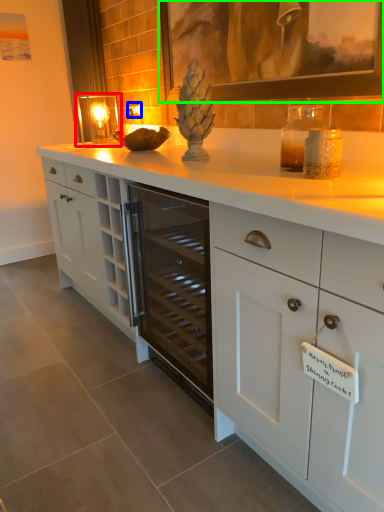
Question: Estimate the real-world distances between objects in this image. Which object is farther from candle holder (highlighted by a red box), electric outlet (highlighted by a blue box) or picture frame (highlighted by a green box)?

Choices:
 (A) electric outlet
 (B) picture frame

Answer: (B)